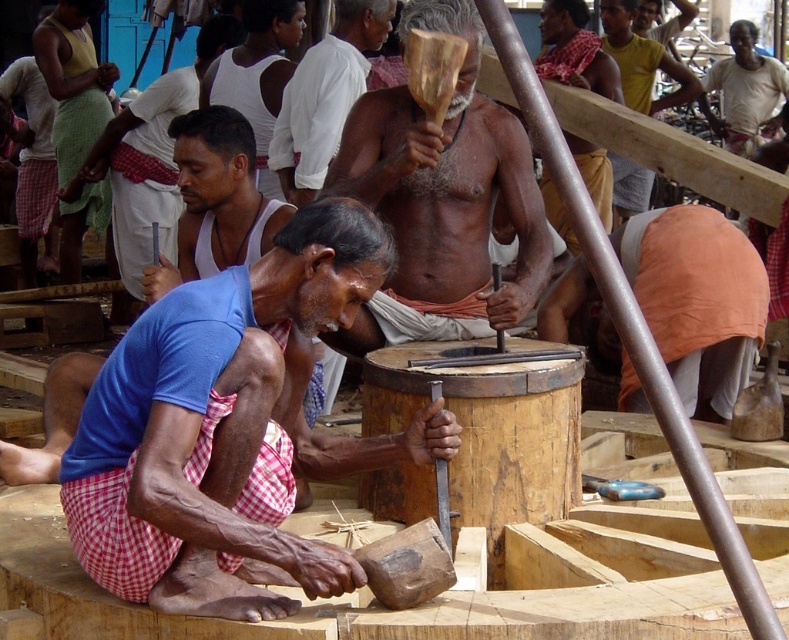
Does yellow cotton shirt at upper right have a smaller size compared to light beige cotton shirt at upper right?

Yes.

Is point (608, 52) less distant than point (731, 28)?

Yes, point (608, 52) is in front of point (731, 28).

Identify the location of yellow cotton shirt at upper right. pos(641,60).

Which is in front, point (305, 60) or point (649, 42)?

Point (305, 60)

Who is more distant from viewer, (x=324, y=113) or (x=626, y=97)?

Positioned behind is point (x=626, y=97).

Find the location of a particular element. The width and height of the screenshot is (789, 640). white cotton shirt at center is located at coordinates (324, 97).

Does orange fabric at lower right have a smaller size compared to yellow cotton shirt at upper right?

Incorrect, orange fabric at lower right is not smaller in size than yellow cotton shirt at upper right.

Is orange fabric at lower right to the left of yellow cotton shirt at upper right from the viewer's perspective?

Indeed, orange fabric at lower right is positioned on the left side of yellow cotton shirt at upper right.

Who is more distant from viewer, (690, 323) or (683, 65)?

The point (683, 65) is more distant.

This screenshot has width=789, height=640. Find the location of `orange fabric at lower right`. orange fabric at lower right is located at coordinates (697, 298).